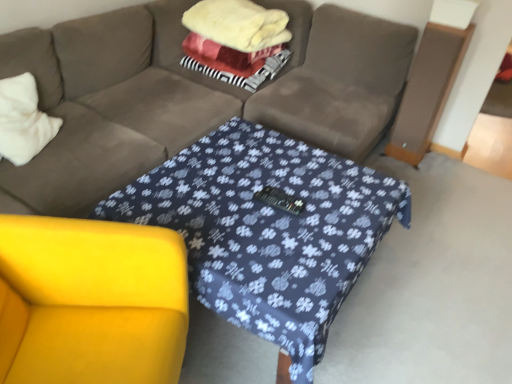
Question: Does yellow fabric armchair at lower left have a lesser width compared to fluffy white blanket at center?

Choices:
 (A) no
 (B) yes

Answer: (A)

Question: Does yellow fabric armchair at lower left have a greater width compared to fluffy white blanket at center?

Choices:
 (A) yes
 (B) no

Answer: (A)

Question: Could you tell me if yellow fabric armchair at lower left is turned towards fluffy white blanket at center?

Choices:
 (A) yes
 (B) no

Answer: (B)

Question: Is the surface of yellow fabric armchair at lower left in direct contact with fluffy white blanket at center?

Choices:
 (A) yes
 (B) no

Answer: (B)

Question: From a real-world perspective, is yellow fabric armchair at lower left below fluffy white blanket at center?

Choices:
 (A) no
 (B) yes

Answer: (B)

Question: Is white soft pillow at left to the left or to the right of fluffy white blanket at center in the image?

Choices:
 (A) left
 (B) right

Answer: (A)

Question: From a real-world perspective, relative to fluffy white blanket at center, is white soft pillow at left vertically above or below?

Choices:
 (A) below
 (B) above

Answer: (A)

Question: Is white soft pillow at left spatially inside fluffy white blanket at center, or outside of it?

Choices:
 (A) outside
 (B) inside

Answer: (A)

Question: Based on their sizes in the image, would you say white soft pillow at left is bigger or smaller than fluffy white blanket at center?

Choices:
 (A) big
 (B) small

Answer: (B)

Question: From the image's perspective, is yellow fabric armchair at lower left positioned above or below fluffy white blanket at center?

Choices:
 (A) above
 (B) below

Answer: (B)

Question: In the image, is yellow fabric armchair at lower left on the left side or the right side of fluffy white blanket at center?

Choices:
 (A) left
 (B) right

Answer: (A)

Question: Looking at their shapes, would you say yellow fabric armchair at lower left is wider or thinner than fluffy white blanket at center?

Choices:
 (A) wide
 (B) thin

Answer: (A)

Question: Looking at the image, does yellow fabric armchair at lower left seem bigger or smaller compared to fluffy white blanket at center?

Choices:
 (A) small
 (B) big

Answer: (B)

Question: In the image, is fluffy white blanket at center positioned in front of or behind yellow fabric armchair at lower left?

Choices:
 (A) front
 (B) behind

Answer: (B)

Question: In terms of height, does fluffy white blanket at center look taller or shorter compared to yellow fabric armchair at lower left?

Choices:
 (A) tall
 (B) short

Answer: (B)